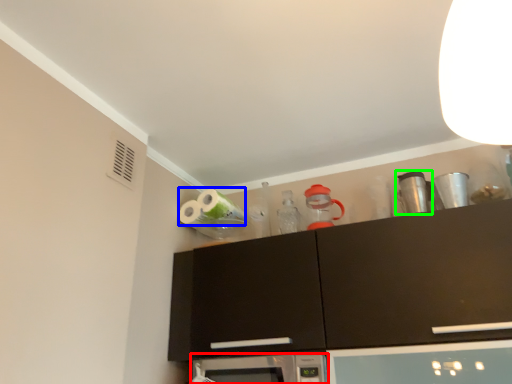
Question: Which object is the farthest from microwave oven (highlighted by a red box)? Choose among these: toilet paper (highlighted by a blue box) or appliance (highlighted by a green box).

Choices:
 (A) toilet paper
 (B) appliance

Answer: (B)